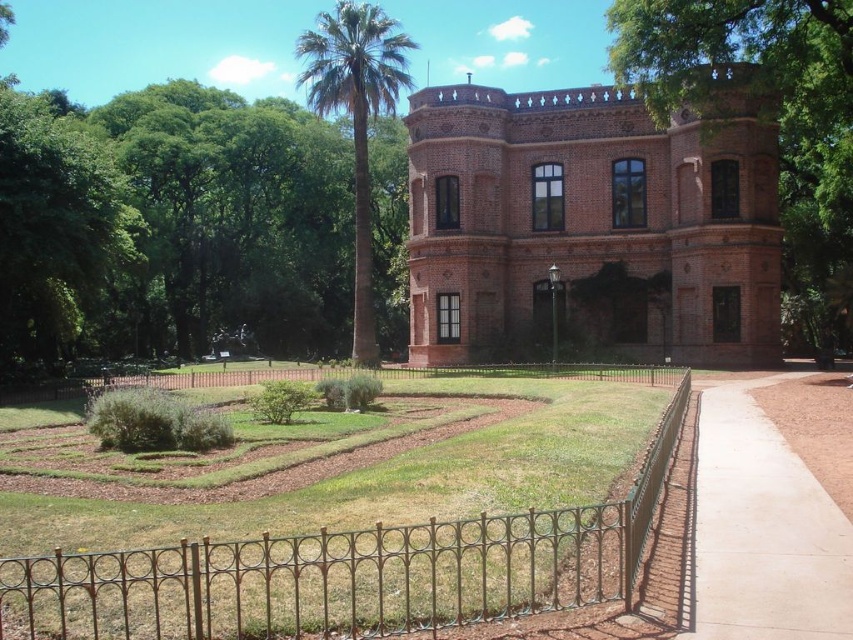
Question: Is green wrought iron fence at center thinner than green leafy palm at center?

Choices:
 (A) no
 (B) yes

Answer: (B)

Question: Which of the following is the farthest from the observer?

Choices:
 (A) green leafy tree at upper center
 (B) green wrought iron fence at center
 (C) light brown concrete sidewalk at lower right
 (D) green leafy palm at center

Answer: (D)

Question: Considering the relative positions of green wrought iron fence at center and green leafy tree at upper center in the image provided, where is green wrought iron fence at center located with respect to green leafy tree at upper center?

Choices:
 (A) below
 (B) above

Answer: (A)

Question: Where is green leafy tree at upper center located in relation to green leafy palm at center in the image?

Choices:
 (A) left
 (B) right

Answer: (B)

Question: Which point is farther from the camera taking this photo?

Choices:
 (A) (827, 86)
 (B) (239, 627)

Answer: (A)

Question: Which of the following is the closest to the observer?

Choices:
 (A) green wrought iron fence at center
 (B) green leafy palm at center

Answer: (A)